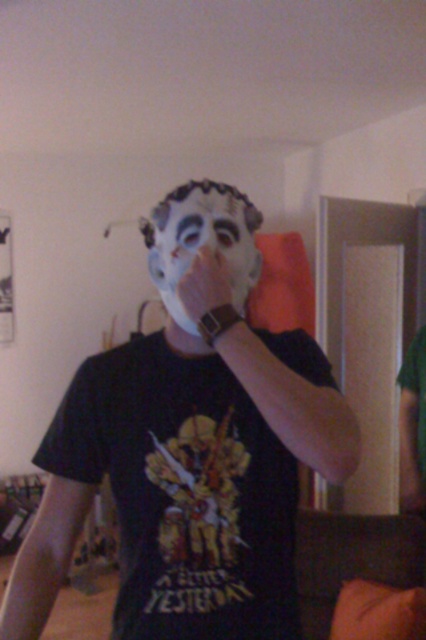
You are a photographer trying to capture the person wearing the black T shirt and two masks. Which mask, the matte white mask at center or the white matte mask at center, is positioned closer to the camera?

The matte white mask at center is closer to the viewer than the white matte mask at center, so the matte white mask at center is positioned closer to the camera.